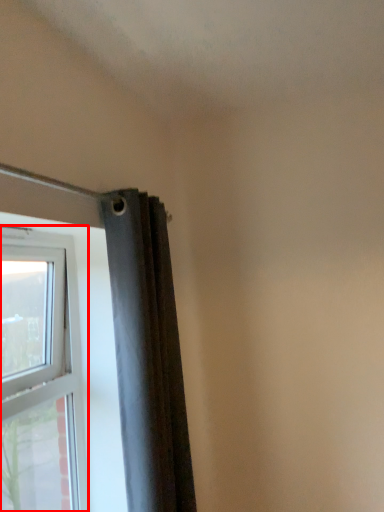
Question: From the image's perspective, where is window (annotated by the red box) located relative to curtain?

Choices:
 (A) above
 (B) below

Answer: (B)